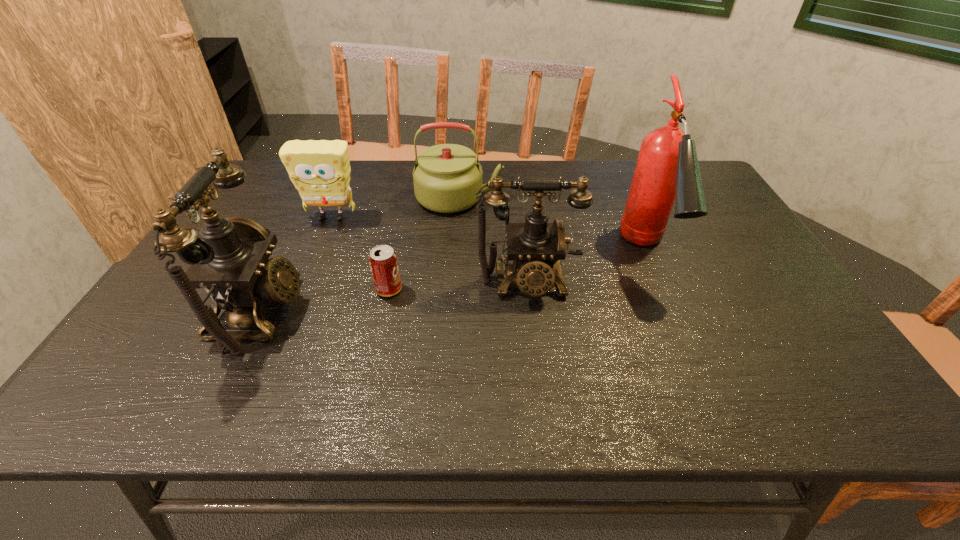
Find the location of a particular element. The image size is (960, 540). vacant space at the right edge is located at coordinates (759, 313).

Where is `free space between the soda can and the third tallest object`? free space between the soda can and the third tallest object is located at coordinates (458, 286).

This screenshot has height=540, width=960. In order to click on unoccupied position between the shorter telephone and the fire extinguisher in this screenshot , I will do `click(588, 268)`.

Where is `free space between the left telephone and the sponge`? This screenshot has height=540, width=960. free space between the left telephone and the sponge is located at coordinates (296, 265).

Find the location of a particular element. free point between the sponge and the kettle is located at coordinates (396, 208).

The width and height of the screenshot is (960, 540). I want to click on free space between the kettle and the shortest object, so click(x=424, y=244).

You are a GUI agent. You are given a task and a screenshot of the screen. Output one action in this format:
    pyautogui.click(x=<x>, y=<y>)
    Task: Click on the free space between the sponge and the rightmost object
    The image size is (960, 540).
    Given the screenshot: What is the action you would take?
    pyautogui.click(x=490, y=235)

You are a GUI agent. You are given a task and a screenshot of the screen. Output one action in this format:
    pyautogui.click(x=<x>, y=<y>)
    Task: Click on the vacant point located between the shorter telephone and the fire extinguisher
    The width and height of the screenshot is (960, 540).
    Given the screenshot: What is the action you would take?
    pyautogui.click(x=588, y=268)

The width and height of the screenshot is (960, 540). Identify the location of vacant area between the left telephone and the sponge. (296, 265).

Locate which object is the closest to the right telephone. Please provide its 2D coordinates. Your answer should be formatted as a tuple, i.e. [(x, y)], where the tuple contains the x and y coordinates of a point satisfying the conditions above.

[(667, 168)]